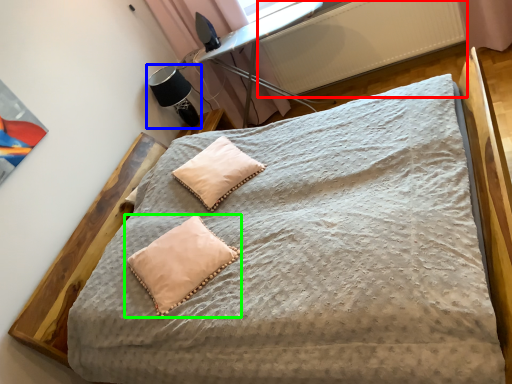
Question: Based on their relative distances, which object is nearer to radiator (highlighted by a red box)? Choose from table lamp (highlighted by a blue box) and pillow (highlighted by a green box).

Choices:
 (A) table lamp
 (B) pillow

Answer: (A)